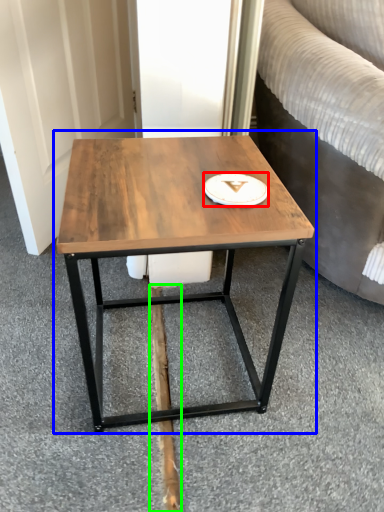
Question: Which object is positioned closest to platter (highlighted by a red box)? Select from coffee table (highlighted by a blue box) and plank (highlighted by a green box).

Choices:
 (A) coffee table
 (B) plank

Answer: (A)